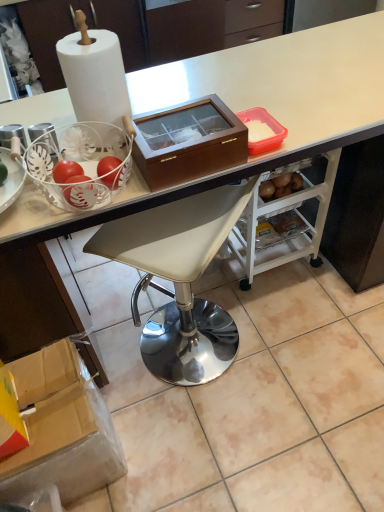
Where is `unoccupied space behind brown wooden box at center, acting as the 1th box starting from the top`? Image resolution: width=384 pixels, height=512 pixels. unoccupied space behind brown wooden box at center, acting as the 1th box starting from the top is located at coordinates (196, 96).